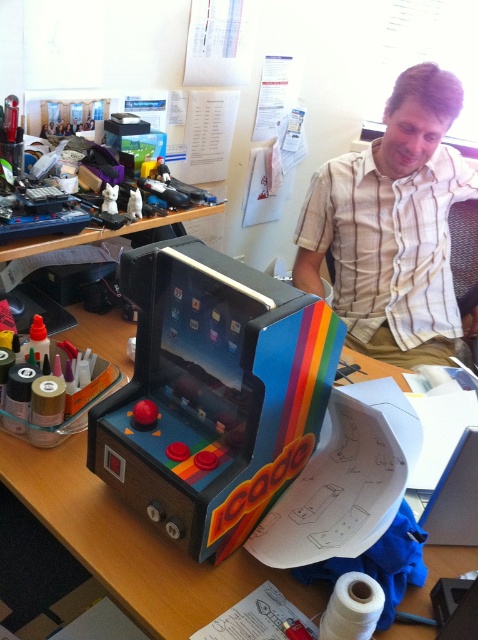
Question: Does striped cotton shirt at upper right appear under rubberized plastic toy at center?

Choices:
 (A) no
 (B) yes

Answer: (A)

Question: Can you confirm if rainbow painted arcade cabinet at center is positioned to the right of rubberized plastic toy at center?

Choices:
 (A) no
 (B) yes

Answer: (B)

Question: Is the position of striped cotton shirt at upper right less distant than that of white plastic toy at center?

Choices:
 (A) yes
 (B) no

Answer: (B)

Question: Among these objects, which one is nearest to the camera?

Choices:
 (A) striped cotton shirt at upper right
 (B) rubberized plastic toy at center
 (C) rainbow painted arcade cabinet at center
 (D) white plastic toy at center

Answer: (C)

Question: Based on their relative distances, which object is farther from the white plastic toy at center?

Choices:
 (A) striped cotton shirt at upper right
 (B) rubberized plastic toy at center

Answer: (A)

Question: Which object appears farthest from the camera in this image?

Choices:
 (A) striped cotton shirt at upper right
 (B) rainbow painted arcade cabinet at center
 (C) rubberized plastic toy at center
 (D) white plastic toy at center

Answer: (A)